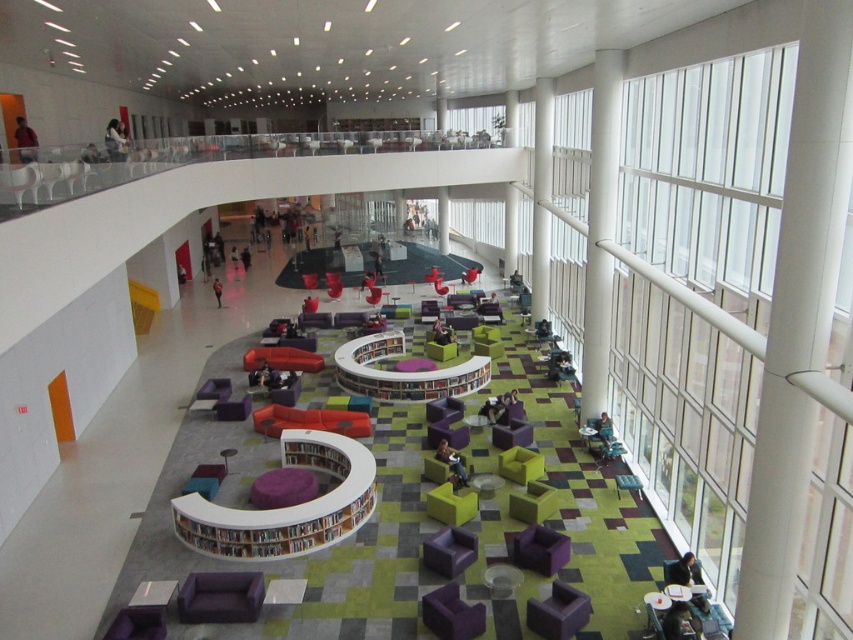
Question: Which point is farther to the camera?

Choices:
 (A) (421, 547)
 (B) (585, 365)
 (C) (380, 497)
 (D) (622, 488)

Answer: (B)

Question: Observing the image, what is the correct spatial positioning of white smooth pillar at right in reference to white smooth pillar at upper center?

Choices:
 (A) above
 (B) below

Answer: (B)

Question: Which object appears farthest from the camera in this image?

Choices:
 (A) white glossy pillar at upper center
 (B) white wood bookshelf at center
 (C) matte black table at center

Answer: (C)

Question: Is purple fabric couches at center positioned before purple fabric chair at center?

Choices:
 (A) no
 (B) yes

Answer: (B)

Question: Which of the following is the closest to the observer?

Choices:
 (A) white glossy pillar at center
 (B) teal fabric chair at lower right
 (C) purple fabric chair at center
 (D) white glossy pillar at upper center

Answer: (B)

Question: Considering the relative positions of matte black table at center and teal fabric chair at lower right in the image provided, where is matte black table at center located with respect to teal fabric chair at lower right?

Choices:
 (A) right
 (B) left

Answer: (B)